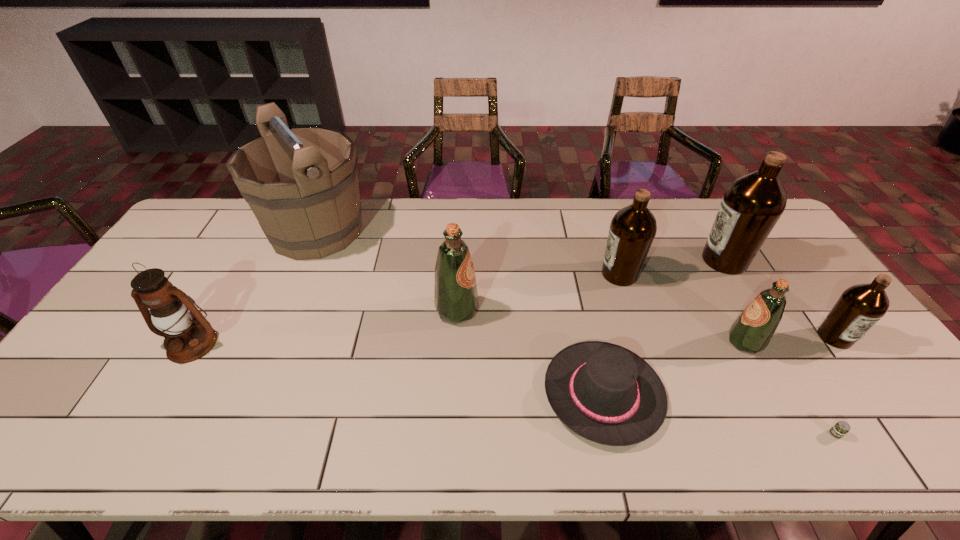
At what (x,y) coordinates should I click in order to perform the action: click on bucket. Please return your answer as a coordinate pair (x, y). The image size is (960, 540). Looking at the image, I should click on (301, 183).

Where is `the tallest olive oil`? The width and height of the screenshot is (960, 540). the tallest olive oil is located at coordinates (751, 206).

Image resolution: width=960 pixels, height=540 pixels. I want to click on the second brown olive oil from left to right, so pyautogui.click(x=751, y=206).

The image size is (960, 540). Identify the location of the third object from left to right. (455, 295).

Find the location of `the left green olive oil`. the left green olive oil is located at coordinates (455, 295).

The image size is (960, 540). In order to click on the leftmost brown olive oil in this screenshot , I will do (x=632, y=230).

I want to click on the second olive oil from left to right, so click(x=632, y=230).

This screenshot has height=540, width=960. What are the coordinates of `brown lantern` in the screenshot? It's located at (172, 311).

Where is `the smaller green olive oil`? The height and width of the screenshot is (540, 960). the smaller green olive oil is located at coordinates (752, 331).

The image size is (960, 540). Identify the location of the nearer green olive oil. (752, 331).